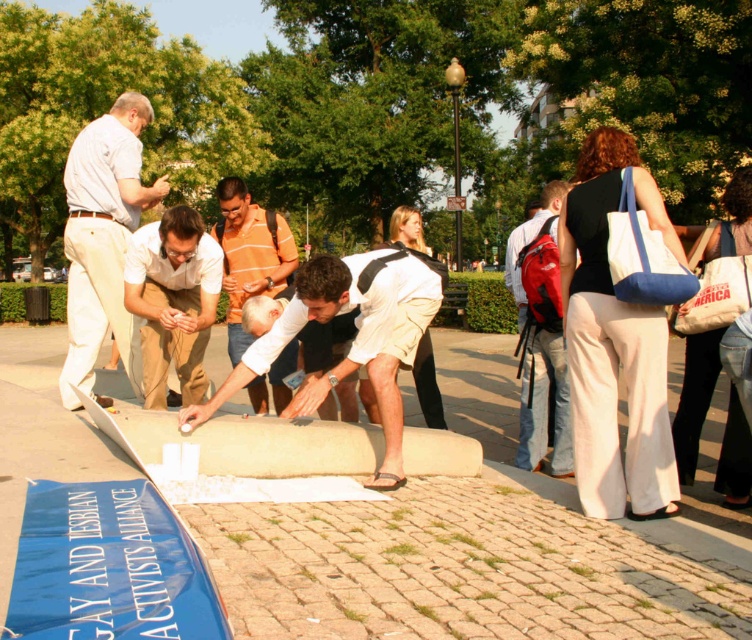
Consider the image. You are organizing a community event and need to decide where to place a new sign. The orange striped shirt at center and the matte red backpack at center are both in the central area. Which object should you place the sign closer to if you want it to be near the smaller item?

The orange striped shirt at center has a smaller size compared to the matte red backpack at center, so you should place the sign closer to the orange striped shirt at center.

You are standing at the edge of the paved area and want to place a 2.5 feet long banner on the smooth concrete pavement at center. Can you walk straight ahead to reach the center without stepping on the existing banner?

The smooth concrete pavement at center is 6.81 feet away from you. Since the existing banner is on the ground at the center, you would need to step over or around it to place your banner, but walking straight ahead would require stepping on it. Therefore, you cannot place the 2.5 feet long banner without stepping on the existing banner.

You are a photographer at the event and want to capture a photo that includes both the smooth concrete pavement at center and the orange striped shirt at center. Based on their positions, which object should appear closer to the camera in the photo?

The smooth concrete pavement at center is in front of the orange striped shirt at center, so it will appear closer to the camera in the photo.